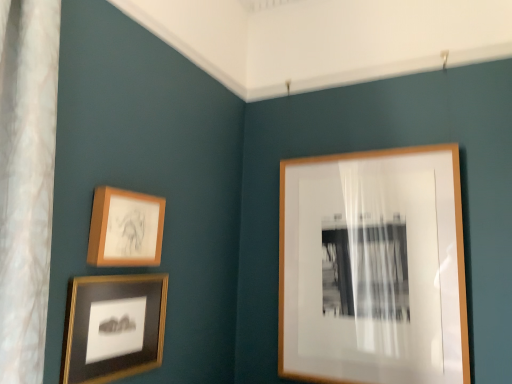
How much space does matte wooden picture frame at upper left, which appears as the second picture frame when viewed from the right, occupy horizontally?

matte wooden picture frame at upper left, which appears as the second picture frame when viewed from the right, is 1.96 inches wide.

Locate an element on the screen. wooden frame at upper right, the 3th picture frame positioned from the left is located at coordinates (373, 268).

Which object is further away from the camera, matte wooden picture frame at upper left, which appears as the second picture frame when viewed from the right, or matte black frame at lower left, the 3th picture frame when ordered from right to left?

matte wooden picture frame at upper left, which appears as the second picture frame when viewed from the right, is behind.

Does matte wooden picture frame at upper left, which ranks as the second picture frame in left-to-right order, have a smaller size compared to matte black frame at lower left, the 3th picture frame when ordered from right to left?

Indeed, matte wooden picture frame at upper left, which ranks as the second picture frame in left-to-right order, has a smaller size compared to matte black frame at lower left, the 3th picture frame when ordered from right to left.

Looking at this image, from the image's perspective, which is above, matte wooden picture frame at upper left, which appears as the second picture frame when viewed from the right, or matte black frame at lower left, arranged as the first picture frame when viewed from the left?

matte wooden picture frame at upper left, which appears as the second picture frame when viewed from the right, from the image's perspective.

From a real-world perspective, is matte wooden picture frame at upper left, which ranks as the second picture frame in left-to-right order, located higher than matte black frame at lower left, the 3th picture frame when ordered from right to left?

Yes.

Is point (106, 215) positioned behind point (432, 194)?

No.

Is the surface of matte wooden picture frame at upper left, which ranks as the second picture frame in left-to-right order, in direct contact with wooden frame at upper right, which is the 1th picture frame from right to left?

matte wooden picture frame at upper left, which ranks as the second picture frame in left-to-right order, and wooden frame at upper right, which is the 1th picture frame from right to left, are not in contact.

From a real-world perspective, relative to wooden frame at upper right, which is the 1th picture frame from right to left, is matte wooden picture frame at upper left, which ranks as the second picture frame in left-to-right order, vertically above or below?

In terms of real-world spatial position, matte wooden picture frame at upper left, which ranks as the second picture frame in left-to-right order, is above wooden frame at upper right, which is the 1th picture frame from right to left.

How distant is matte wooden picture frame at upper left, which ranks as the second picture frame in left-to-right order, from wooden frame at upper right, which is the 1th picture frame from right to left?

A distance of 33.04 inches exists between matte wooden picture frame at upper left, which ranks as the second picture frame in left-to-right order, and wooden frame at upper right, which is the 1th picture frame from right to left.

Could you tell me if wooden frame at upper right, which is the 1th picture frame from right to left, is turned towards matte black frame at lower left, the 3th picture frame when ordered from right to left?

Yes, wooden frame at upper right, which is the 1th picture frame from right to left, is facing matte black frame at lower left, the 3th picture frame when ordered from right to left.

How distant is wooden frame at upper right, which is the 1th picture frame from right to left, from matte black frame at lower left, arranged as the first picture frame when viewed from the left?

wooden frame at upper right, which is the 1th picture frame from right to left, and matte black frame at lower left, arranged as the first picture frame when viewed from the left, are 32.12 inches apart from each other.

Who is more distant, wooden frame at upper right, which is the 1th picture frame from right to left, or matte black frame at lower left, arranged as the first picture frame when viewed from the left?

wooden frame at upper right, which is the 1th picture frame from right to left.

Do you think wooden frame at upper right, the 3th picture frame positioned from the left, is within matte black frame at lower left, the 3th picture frame when ordered from right to left, or outside of it?

wooden frame at upper right, the 3th picture frame positioned from the left, is not inside matte black frame at lower left, the 3th picture frame when ordered from right to left, it's outside.

Can you confirm if wooden frame at upper right, the 3th picture frame positioned from the left, is positioned to the left of matte wooden picture frame at upper left, which appears as the second picture frame when viewed from the right?

No, wooden frame at upper right, the 3th picture frame positioned from the left, is not to the left of matte wooden picture frame at upper left, which appears as the second picture frame when viewed from the right.

Between wooden frame at upper right, which is the 1th picture frame from right to left, and matte wooden picture frame at upper left, which ranks as the second picture frame in left-to-right order, which one has larger width?

wooden frame at upper right, which is the 1th picture frame from right to left.

Is there a large distance between wooden frame at upper right, the 3th picture frame positioned from the left, and matte wooden picture frame at upper left, which ranks as the second picture frame in left-to-right order?

That's not correct — wooden frame at upper right, the 3th picture frame positioned from the left, is a little close to matte wooden picture frame at upper left, which ranks as the second picture frame in left-to-right order.

Which of these two, matte black frame at lower left, arranged as the first picture frame when viewed from the left, or wooden frame at upper right, which is the 1th picture frame from right to left, is thinner?

matte black frame at lower left, arranged as the first picture frame when viewed from the left.

Is matte black frame at lower left, arranged as the first picture frame when viewed from the left, further to the viewer compared to wooden frame at upper right, which is the 1th picture frame from right to left?

No, it is in front of wooden frame at upper right, which is the 1th picture frame from right to left.

Is matte black frame at lower left, the 3th picture frame when ordered from right to left, oriented towards wooden frame at upper right, which is the 1th picture frame from right to left?

No, matte black frame at lower left, the 3th picture frame when ordered from right to left, does not turn towards wooden frame at upper right, which is the 1th picture frame from right to left.

Does matte black frame at lower left, arranged as the first picture frame when viewed from the left, contain wooden frame at upper right, the 3th picture frame positioned from the left?

No, matte black frame at lower left, arranged as the first picture frame when viewed from the left, does not contain wooden frame at upper right, the 3th picture frame positioned from the left.

From the picture: Which is more to the right, matte black frame at lower left, arranged as the first picture frame when viewed from the left, or matte wooden picture frame at upper left, which ranks as the second picture frame in left-to-right order?

matte wooden picture frame at upper left, which ranks as the second picture frame in left-to-right order.

Is matte black frame at lower left, arranged as the first picture frame when viewed from the left, with matte wooden picture frame at upper left, which ranks as the second picture frame in left-to-right order?

matte black frame at lower left, arranged as the first picture frame when viewed from the left, and matte wooden picture frame at upper left, which ranks as the second picture frame in left-to-right order, are not in contact.

Is matte black frame at lower left, arranged as the first picture frame when viewed from the left, turned away from matte wooden picture frame at upper left, which ranks as the second picture frame in left-to-right order?

No, matte black frame at lower left, arranged as the first picture frame when viewed from the left, is not facing the opposite direction of matte wooden picture frame at upper left, which ranks as the second picture frame in left-to-right order.

Locate an element on the screen. picture frame that is the 1st one when counting rightward from the matte black frame at lower left, the 3th picture frame when ordered from right to left is located at coordinates pos(125,228).

Starting from the wooden frame at upper right, which is the 1th picture frame from right to left, which picture frame is the 1st one to the left? Please provide its 2D coordinates.

[(125, 228)]

From the picture: Which object lies nearer to the anchor point matte wooden picture frame at upper left, which ranks as the second picture frame in left-to-right order, wooden frame at upper right, the 3th picture frame positioned from the left, or matte black frame at lower left, arranged as the first picture frame when viewed from the left?

Among the two, matte black frame at lower left, arranged as the first picture frame when viewed from the left, is located nearer to matte wooden picture frame at upper left, which ranks as the second picture frame in left-to-right order.

When comparing their distances from wooden frame at upper right, which is the 1th picture frame from right to left, does matte black frame at lower left, the 3th picture frame when ordered from right to left, or matte wooden picture frame at upper left, which ranks as the second picture frame in left-to-right order, seem further?

Among the two, matte wooden picture frame at upper left, which ranks as the second picture frame in left-to-right order, is located further to wooden frame at upper right, which is the 1th picture frame from right to left.

Considering their positions, is matte black frame at lower left, the 3th picture frame when ordered from right to left, positioned further to matte wooden picture frame at upper left, which ranks as the second picture frame in left-to-right order, than wooden frame at upper right, the 3th picture frame positioned from the left?

wooden frame at upper right, the 3th picture frame positioned from the left, lies further to matte wooden picture frame at upper left, which ranks as the second picture frame in left-to-right order, than the other object.

In the scene shown: When comparing their distances from wooden frame at upper right, which is the 1th picture frame from right to left, does matte wooden picture frame at upper left, which appears as the second picture frame when viewed from the right, or matte black frame at lower left, the 3th picture frame when ordered from right to left, seem closer?

Among the two, matte black frame at lower left, the 3th picture frame when ordered from right to left, is located nearer to wooden frame at upper right, which is the 1th picture frame from right to left.

Looking at the image, which one is located closer to matte black frame at lower left, arranged as the first picture frame when viewed from the left, wooden frame at upper right, which is the 1th picture frame from right to left, or matte wooden picture frame at upper left, which ranks as the second picture frame in left-to-right order?

Based on the image, matte wooden picture frame at upper left, which ranks as the second picture frame in left-to-right order, appears to be nearer to matte black frame at lower left, arranged as the first picture frame when viewed from the left.

Estimate the real-world distances between objects in this image. Which object is further from matte black frame at lower left, arranged as the first picture frame when viewed from the left, matte wooden picture frame at upper left, which ranks as the second picture frame in left-to-right order, or wooden frame at upper right, which is the 1th picture frame from right to left?

wooden frame at upper right, which is the 1th picture frame from right to left, is positioned further to the anchor matte black frame at lower left, arranged as the first picture frame when viewed from the left.

The width and height of the screenshot is (512, 384). In order to click on picture frame between matte black frame at lower left, the 3th picture frame when ordered from right to left, and wooden frame at upper right, which is the 1th picture frame from right to left, in the horizontal direction in this screenshot , I will do `click(125, 228)`.